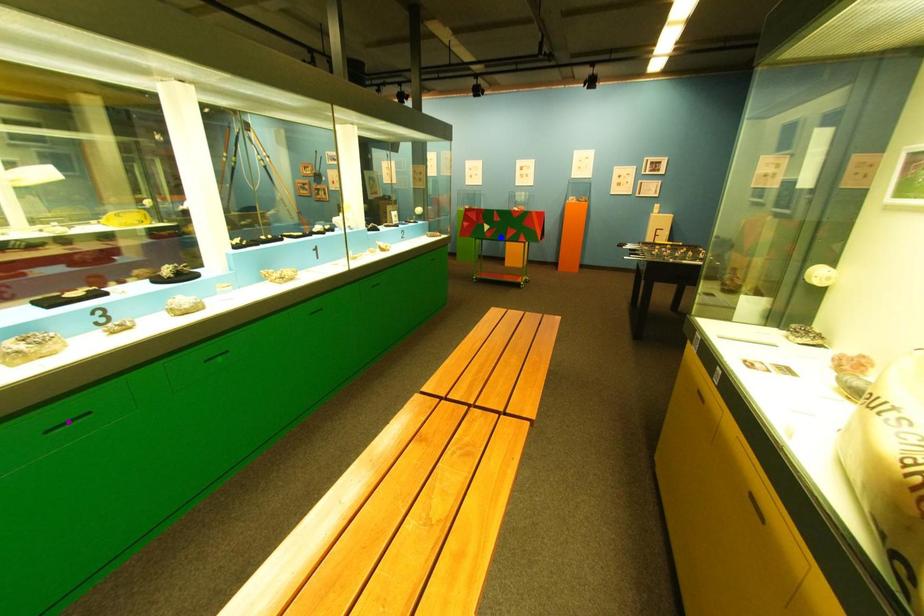
Order these from nearest to farthest:
A) purple point
B) blue point
C) green point

purple point → green point → blue point